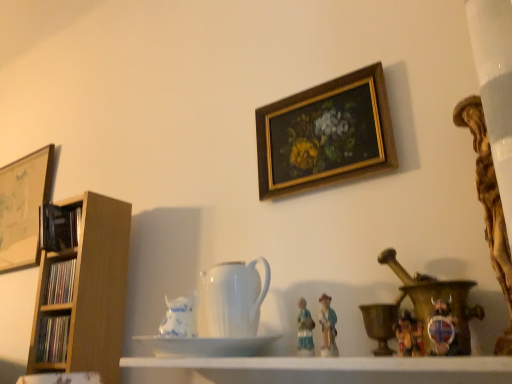
Measure the distance between white glossy shelf at center and camera.

25.19 inches.

What do you see at coordinates (180, 317) in the screenshot? The height and width of the screenshot is (384, 512). I see `blue and white porcelain vase at center` at bounding box center [180, 317].

The height and width of the screenshot is (384, 512). What are the coordinates of `brass/bronze candle holder at right` in the screenshot? It's located at [380, 324].

The image size is (512, 384). Describe the element at coordinates (23, 207) in the screenshot. I see `wooden picture frame at left, acting as the 2th picture frame starting from the right` at that location.

Identify the location of wooden bookshelf at left, the 2th book from the bottom. (60, 282).

Where is `book that is the 2nd object to the left of the white glossy shelf at center, starting at the anchor`? The width and height of the screenshot is (512, 384). book that is the 2nd object to the left of the white glossy shelf at center, starting at the anchor is located at coordinates (60, 282).

Between point (66, 288) and point (141, 367), which one is positioned in front?

The point (141, 367) is closer.

Which object is more forward, wooden bookshelf at left, the 2th book from the bottom, or white glossy shelf at center?

white glossy shelf at center is in front.

From the picture: Between wooden bookshelf at left, which ranks as the second book in top-to-bottom order, and white glossy shelf at center, which one appears on the left side from the viewer's perspective?

wooden bookshelf at left, which ranks as the second book in top-to-bottom order, is more to the left.

Is black matte bookshelf at left, marked as the 3th book in a bottom-to-top arrangement, at the left side of white porcelain pitcher at center?

Correct, you'll find black matte bookshelf at left, marked as the 3th book in a bottom-to-top arrangement, to the left of white porcelain pitcher at center.

From the image's perspective, is black matte bookshelf at left, marked as the 3th book in a bottom-to-top arrangement, over white porcelain pitcher at center?

Indeed, from the image's perspective, black matte bookshelf at left, marked as the 3th book in a bottom-to-top arrangement, is shown above white porcelain pitcher at center.

Is white porcelain pitcher at center at the back of black matte bookshelf at left, the 1th book when ordered from top to bottom?

No.

From a real-world perspective, which is physically below, black matte bookshelf at left, the 1th book when ordered from top to bottom, or white porcelain pitcher at center?

white porcelain pitcher at center is physically lower.

From the image's perspective, which is below, gold wooden picture frame at upper center, acting as the 2th picture frame starting from the left, or wooden bookshelf at left, which ranks as the second book in top-to-bottom order?

wooden bookshelf at left, which ranks as the second book in top-to-bottom order.

Considering the relative sizes of gold wooden picture frame at upper center, acting as the second picture frame starting from the back, and wooden bookshelf at left, the 2th book from the bottom, in the image provided, is gold wooden picture frame at upper center, acting as the second picture frame starting from the back, bigger than wooden bookshelf at left, the 2th book from the bottom,?

Indeed, gold wooden picture frame at upper center, acting as the second picture frame starting from the back, has a larger size compared to wooden bookshelf at left, the 2th book from the bottom.

Which object is positioned more to the right, gold wooden picture frame at upper center, acting as the 2th picture frame starting from the left, or wooden bookshelf at left, the 2th book from the bottom?

gold wooden picture frame at upper center, acting as the 2th picture frame starting from the left, is more to the right.

Measure the distance between gold wooden picture frame at upper center, acting as the 2th picture frame starting from the left, and wooden bookshelf at left, the 2th book from the bottom.

gold wooden picture frame at upper center, acting as the 2th picture frame starting from the left, and wooden bookshelf at left, the 2th book from the bottom, are 31.28 inches apart.

Considering the sizes of objects brass/bronze candle holder at right and white glossy shelf at center in the image provided, who is thinner, brass/bronze candle holder at right or white glossy shelf at center?

Thinner between the two is brass/bronze candle holder at right.

Is brass/bronze candle holder at right not near white glossy shelf at center?

No, brass/bronze candle holder at right is in close proximity to white glossy shelf at center.

Consider the image. Is white glossy saucer at center beside white porcelain pitcher at center?

Yes, white glossy saucer at center is touching white porcelain pitcher at center.

Considering the sizes of objects white glossy saucer at center and white porcelain pitcher at center in the image provided, who is shorter, white glossy saucer at center or white porcelain pitcher at center?

With less height is white glossy saucer at center.

Considering the sizes of objects white glossy saucer at center and white porcelain pitcher at center in the image provided, who is smaller, white glossy saucer at center or white porcelain pitcher at center?

With smaller size is white glossy saucer at center.

Is gold wooden picture frame at upper center, acting as the 2th picture frame starting from the left, looking in the opposite direction of brass/bronze candle holder at right?

No, gold wooden picture frame at upper center, acting as the 2th picture frame starting from the left,'s orientation is not away from brass/bronze candle holder at right.

Is gold wooden picture frame at upper center, acting as the 2th picture frame starting from the left, touching brass/bronze candle holder at right?

No.

From the image's perspective, count 2nd picture frames upward from the brass/bronze candle holder at right and point to it. Please provide its 2D coordinates.

[(325, 134)]

Which object is wider, gold wooden picture frame at upper center, the 1th picture frame when ordered from right to left, or brass/bronze candle holder at right?

brass/bronze candle holder at right is wider.

From a real-world perspective, is white porcelain pitcher at center positioned above or below wooden picture frame at left, placed as the second picture frame when sorted from front to back?

white porcelain pitcher at center is situated lower than wooden picture frame at left, placed as the second picture frame when sorted from front to back, in the real world.

Is white porcelain pitcher at center to the right of wooden picture frame at left, the 1th picture frame in the left-to-right sequence, from the viewer's perspective?

Indeed, white porcelain pitcher at center is positioned on the right side of wooden picture frame at left, the 1th picture frame in the left-to-right sequence.

Is white porcelain pitcher at center not within wooden picture frame at left, the first picture frame in the back-to-front sequence?

Yes.

Can you tell me how much white porcelain pitcher at center and wooden picture frame at left, the first picture frame in the back-to-front sequence, differ in facing direction?

The angle between the facing direction of white porcelain pitcher at center and the facing direction of wooden picture frame at left, the first picture frame in the back-to-front sequence, is 2.22 degrees.

Image resolution: width=512 pixels, height=384 pixels. Find the location of `shelf below the wooden bookshelf at left, the 2th book from the bottom (from a real-world perspective)`. shelf below the wooden bookshelf at left, the 2th book from the bottom (from a real-world perspective) is located at coordinates (338, 369).

Find the location of a particular element. The height and width of the screenshot is (384, 512). book above the white porcelain pitcher at center (from the image's perspective) is located at coordinates (59, 227).

Based on the photo, estimate the real-world distances between objects in this image. Which object is closer to black matte bookshelf at left, the 1th book when ordered from top to bottom, wooden bookshelf at left, the 2th book from the bottom, or white porcelain pitcher at center?

wooden bookshelf at left, the 2th book from the bottom.

Estimate the real-world distances between objects in this image. Which object is closer to wooden bookshelf at left, the 2th book from the bottom, wooden picture frame at left, acting as the 2th picture frame starting from the right, or brass/bronze candle holder at right?

The object closer to wooden bookshelf at left, the 2th book from the bottom, is wooden picture frame at left, acting as the 2th picture frame starting from the right.

Based on their spatial positions, is blue and white porcelain vase at center or white porcelain pitcher at center further from wooden picture frame at left, the 1th picture frame in the left-to-right sequence?

The object further to wooden picture frame at left, the 1th picture frame in the left-to-right sequence, is white porcelain pitcher at center.

Estimate the real-world distances between objects in this image. Which object is closer to black matte bookshelf at left, the 1th book when ordered from top to bottom, wooden picture frame at left, the first picture frame in the back-to-front sequence, or gold wooden picture frame at upper center, the 1th picture frame when ordered from front to back?

wooden picture frame at left, the first picture frame in the back-to-front sequence, lies closer to black matte bookshelf at left, the 1th book when ordered from top to bottom, than the other object.

Considering their positions, is wooden bookshelf at left, the 2th book from the bottom, positioned further to matte wooden bookshelf at left, marked as the 1th book in a bottom-to-top arrangement, than blue and white porcelain vase at center?

blue and white porcelain vase at center is further to matte wooden bookshelf at left, marked as the 1th book in a bottom-to-top arrangement.

Based on their spatial positions, is gold wooden picture frame at upper center, the 1th picture frame when ordered from right to left, or black matte bookshelf at left, the 1th book when ordered from top to bottom, closer to wooden bookshelf at left, the 2th book from the bottom?

black matte bookshelf at left, the 1th book when ordered from top to bottom, is positioned closer to the anchor wooden bookshelf at left, the 2th book from the bottom.

Estimate the real-world distances between objects in this image. Which object is further from white glossy shelf at center, wooden bookshelf at left, which ranks as the second book in top-to-bottom order, or brass/bronze candle holder at right?

wooden bookshelf at left, which ranks as the second book in top-to-bottom order, is further to white glossy shelf at center.

Looking at the image, which one is located closer to black matte bookshelf at left, the 1th book when ordered from top to bottom, white glossy shelf at center or white glossy saucer at center?

Based on the image, white glossy saucer at center appears to be nearer to black matte bookshelf at left, the 1th book when ordered from top to bottom.

I want to click on pottery between black matte bookshelf at left, marked as the 3th book in a bottom-to-top arrangement, and brass/bronze candle holder at right, in the horizontal direction, so click(x=232, y=299).

This screenshot has width=512, height=384. Identify the location of pottery situated between matte wooden bookshelf at left, marked as the 1th book in a bottom-to-top arrangement, and gold wooden picture frame at upper center, the 1th picture frame when ordered from front to back, from left to right. (232, 299).

Identify the location of shelf located between wooden picture frame at left, acting as the 2th picture frame starting from the right, and brass/bronze candle holder at right in the left-right direction. This screenshot has width=512, height=384. (338, 369).

Locate an element on the screen. toy situated between wooden bookshelf at left, which ranks as the second book in top-to-bottom order, and white porcelain pitcher at center from left to right is located at coordinates click(180, 317).